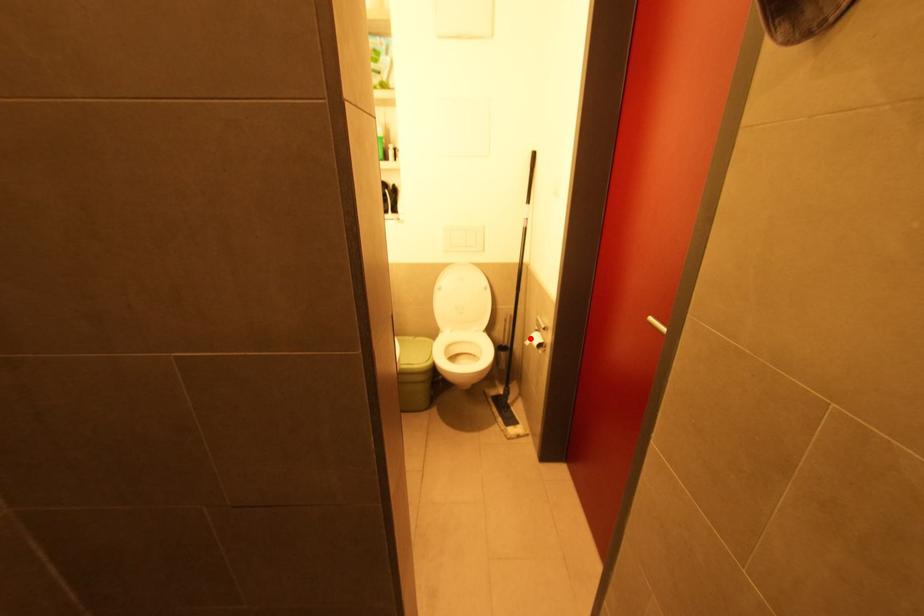
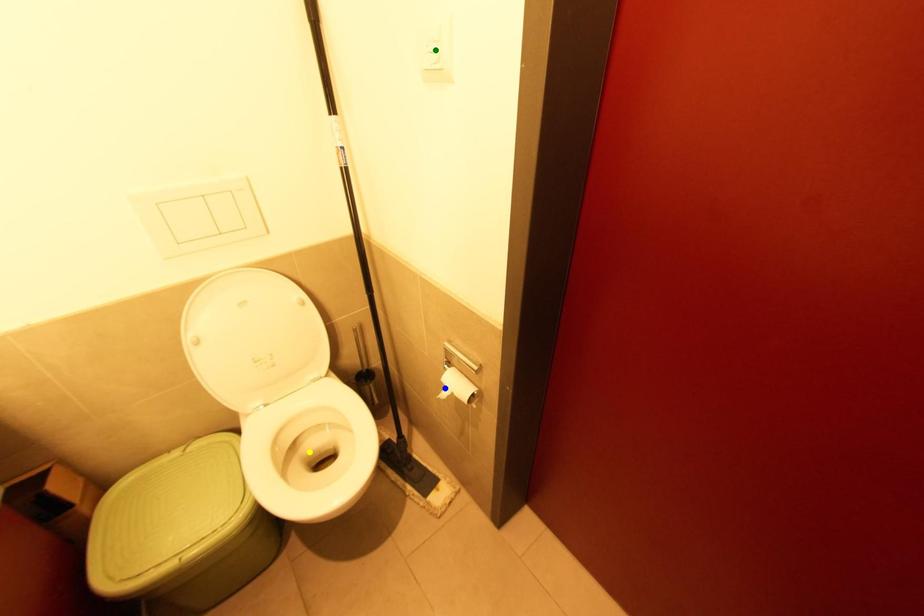
Question: I am providing you with two images of the same scene from different viewpoints. A red point is marked on the first image. You are given multiple points on the second image. Which spot in image 2 lines up with the point in image 1?

Choices:
 (A) green point
 (B) yellow point
 (C) blue point

Answer: (C)